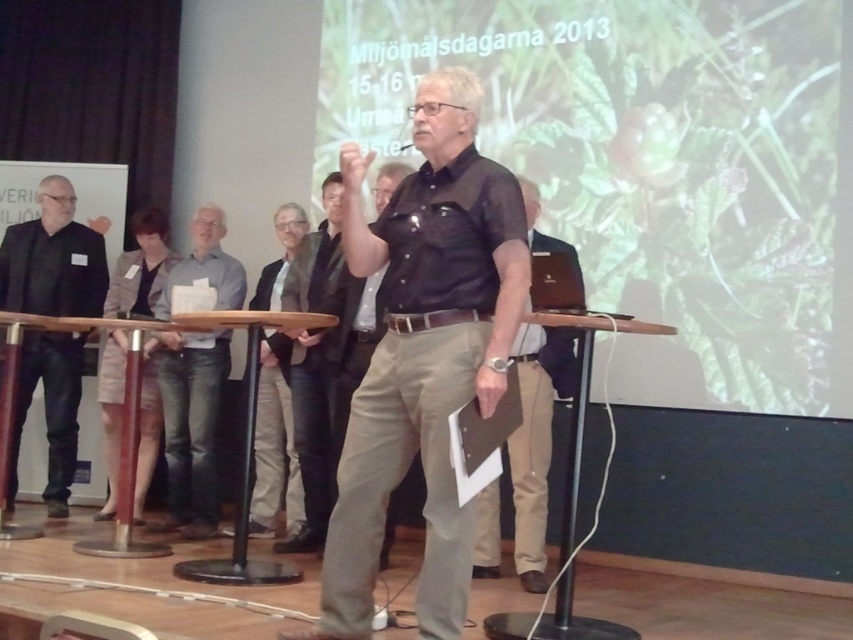
You are attending the event and want to take a photo of the speaker. The camera you have can only focus on objects within 15 feet. Is the jeans at center within the camera focus range?

The jeans at center is 14.55 feet away from the camera, which is within the 15 feet focus range. Therefore, the camera can focus on the jeans at center.